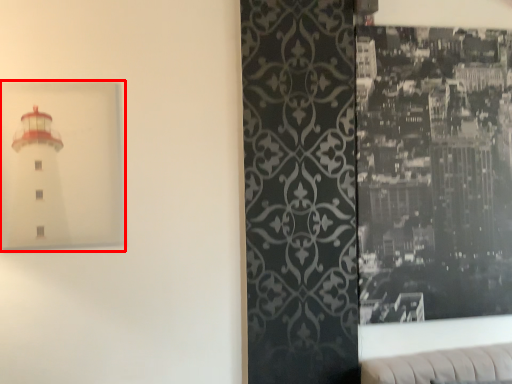
Question: From the image's perspective, where is picture frame (annotated by the red box) located relative to picture frame?

Choices:
 (A) above
 (B) below

Answer: (A)